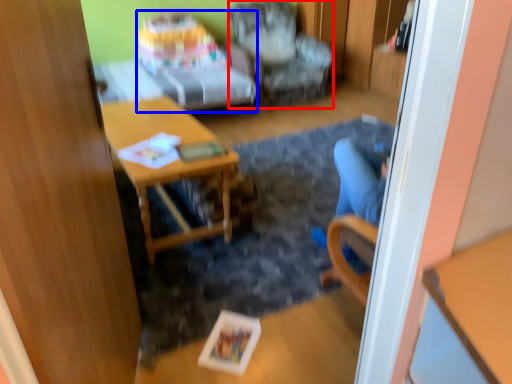
Question: Which object is further to the camera taking this photo, chair (highlighted by a red box) or studio couch (highlighted by a blue box)?

Choices:
 (A) chair
 (B) studio couch

Answer: (A)